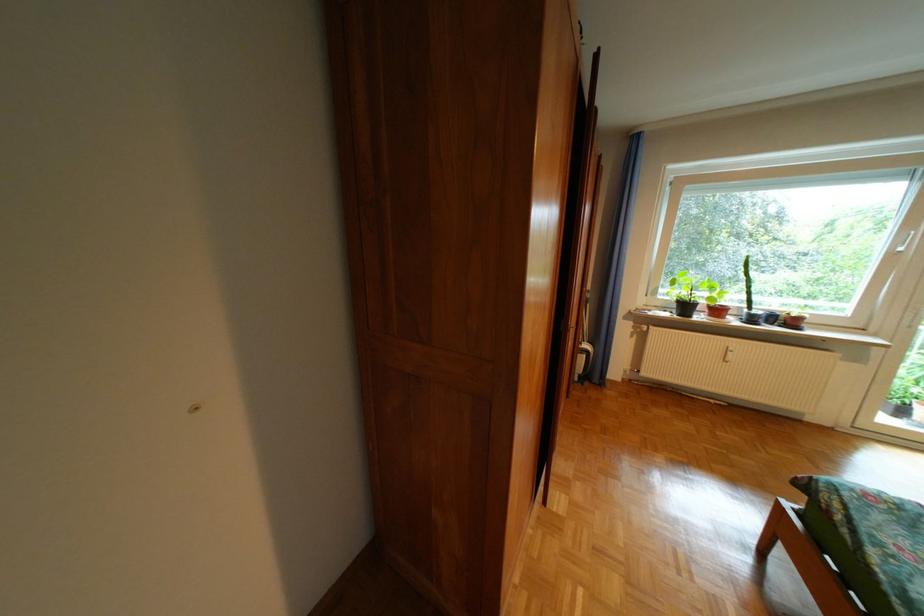
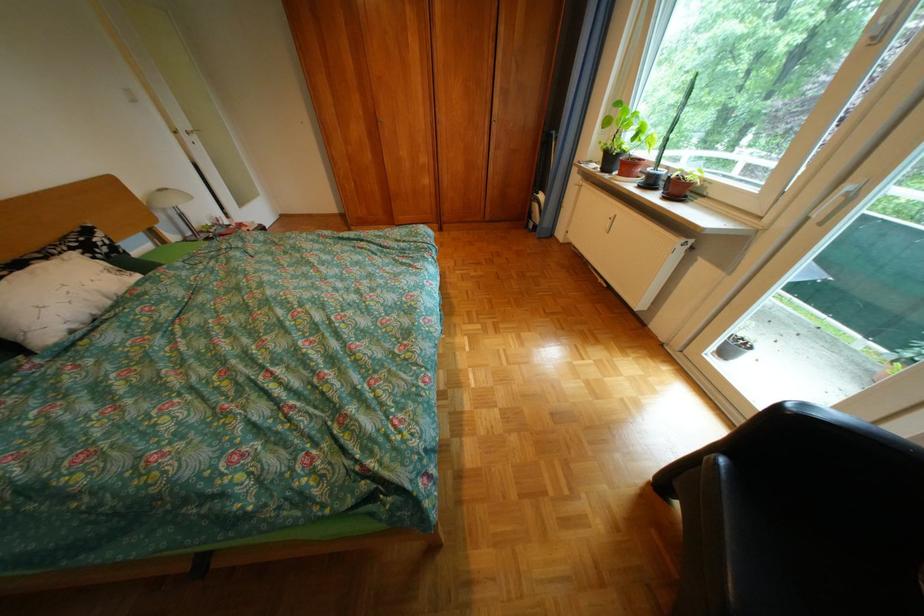
The point at (679, 315) is marked in the first image. Where is the corresponding point in the second image?

(610, 168)